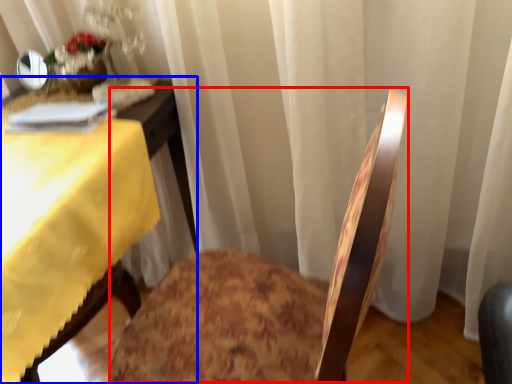
Question: Among these objects, which one is nearest to the camera, rocking chair (highlighted by a red box) or table (highlighted by a blue box)?

Choices:
 (A) rocking chair
 (B) table

Answer: (A)